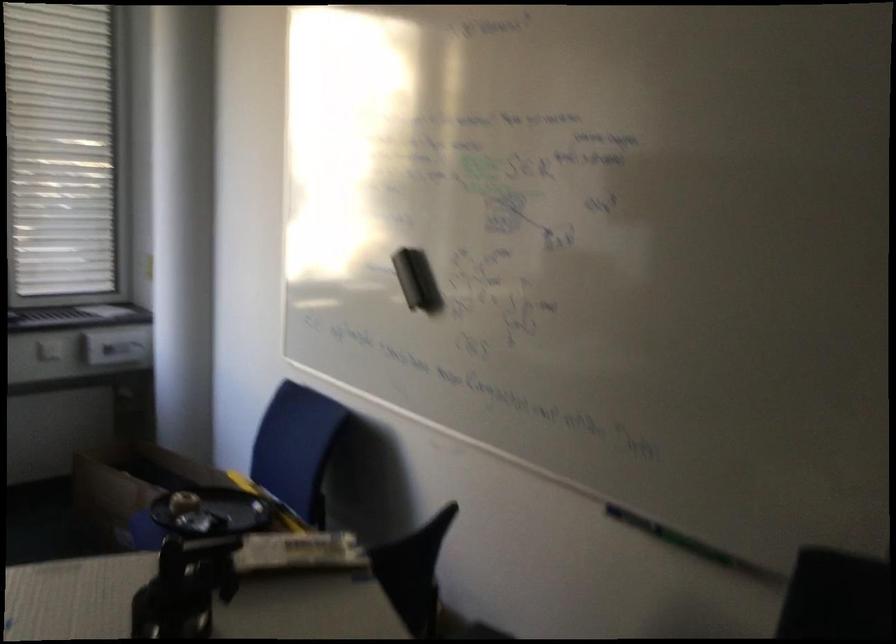
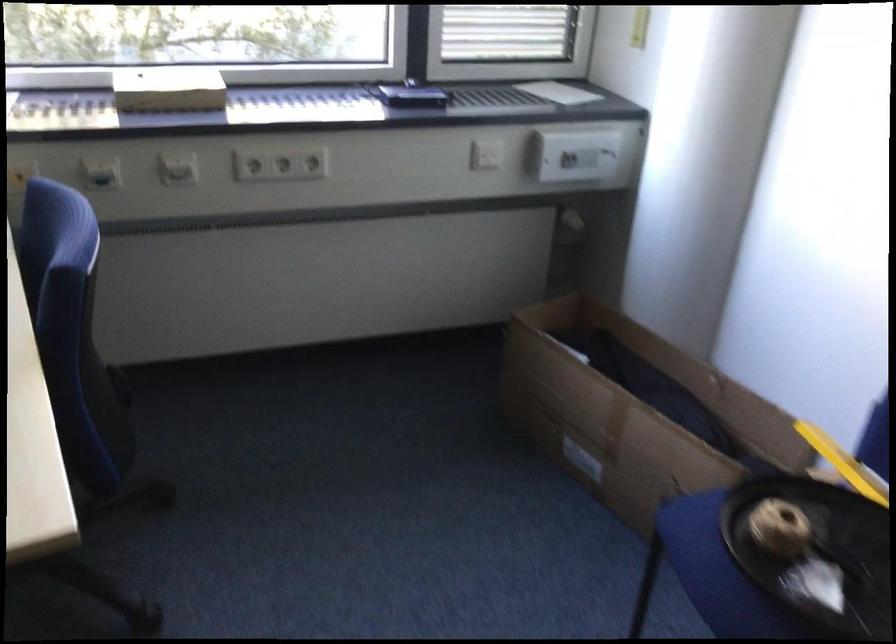
Locate, in the second image, the point that corresponds to pixel 195 512 in the first image.

(813, 552)